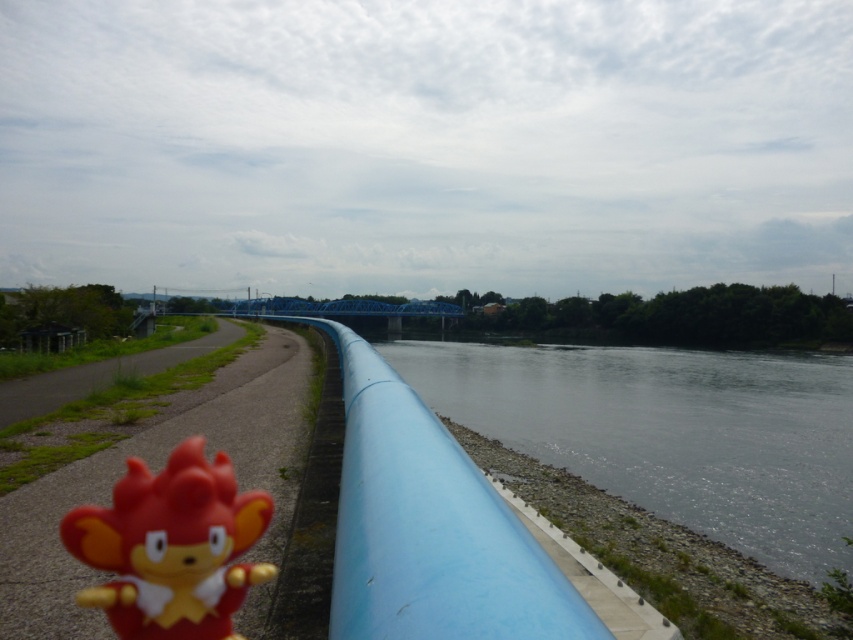
Question: Which point appears farthest from the camera in this image?

Choices:
 (A) (650, 504)
 (B) (251, 532)

Answer: (A)

Question: From the image, what is the correct spatial relationship of blue smooth pipe at lower center in relation to rubber toy at lower left?

Choices:
 (A) below
 (B) above

Answer: (A)

Question: Does blue smooth pipe at lower center have a greater width compared to rubber toy at lower left?

Choices:
 (A) yes
 (B) no

Answer: (A)

Question: Is blue smooth pipe at lower center behind rubber toy at lower left?

Choices:
 (A) yes
 (B) no

Answer: (A)

Question: Which of the following is the farthest from the observer?

Choices:
 (A) rubber toy at lower left
 (B) blue smooth pipe at lower center

Answer: (B)